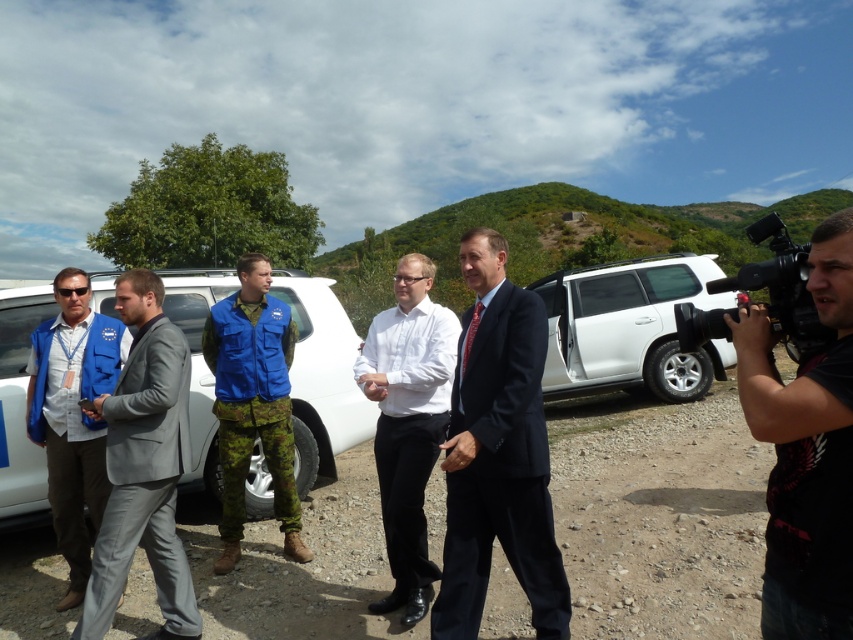
Question: Is white matte van at center smaller than blue fabric vest at left?

Choices:
 (A) no
 (B) yes

Answer: (A)

Question: Considering the real-world distances, which object is farthest from the black fabric camera at right?

Choices:
 (A) white matte van at center
 (B) dark blue suit at center
 (C) gray suit at center

Answer: (A)

Question: Is black fabric camera at right smaller than white glossy shirt at center?

Choices:
 (A) yes
 (B) no

Answer: (B)

Question: Which point is closer to the camera?

Choices:
 (A) white matte suv at right
 (B) dark blue suit at center
 (C) white matte van at center

Answer: (B)

Question: Which point appears farthest from the camera in this image?

Choices:
 (A) (703, 336)
 (B) (300, 296)
 (C) (541, 324)
 (D) (403, 323)

Answer: (B)

Question: Does dark blue suit at center have a lesser width compared to blue fabric vest at left?

Choices:
 (A) no
 (B) yes

Answer: (B)